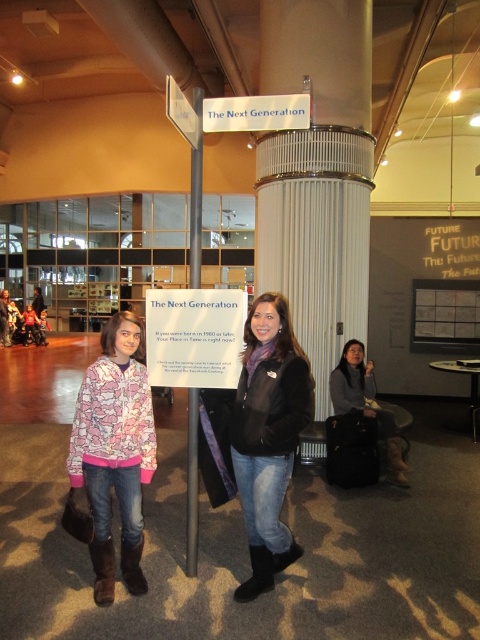
Based on the photo, you are an artist planning to paint this scene. You want to ensure the pink printed jacket at center and the white glossy pole at center are proportionally accurate. Which object should you draw taller in your painting?

The pink printed jacket at center should be drawn taller in the painting since it has a greater height compared to the white glossy pole at center according to the description.

You are standing in the museum and want to determine which of the two points, point (x=240, y=392) or point (x=333, y=384), is closer to you. Based on the scene description, which point is nearer?

Point (x=240, y=392) is closer to the viewer than point (x=333, y=384).